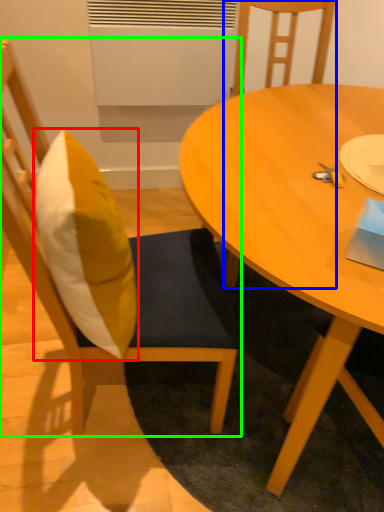
Question: Which object is positioned farthest from pillow (highlighted by a red box)? Select from chair (highlighted by a blue box) and chair (highlighted by a green box).

Choices:
 (A) chair
 (B) chair

Answer: (A)